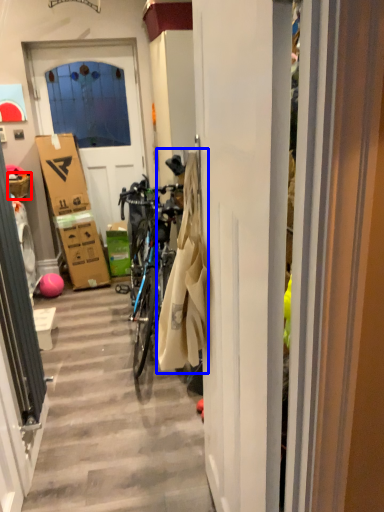
Question: Among these objects, which one is nearest to the camera, picnic basket (highlighted by a red box) or laundry (highlighted by a blue box)?

Choices:
 (A) picnic basket
 (B) laundry

Answer: (B)